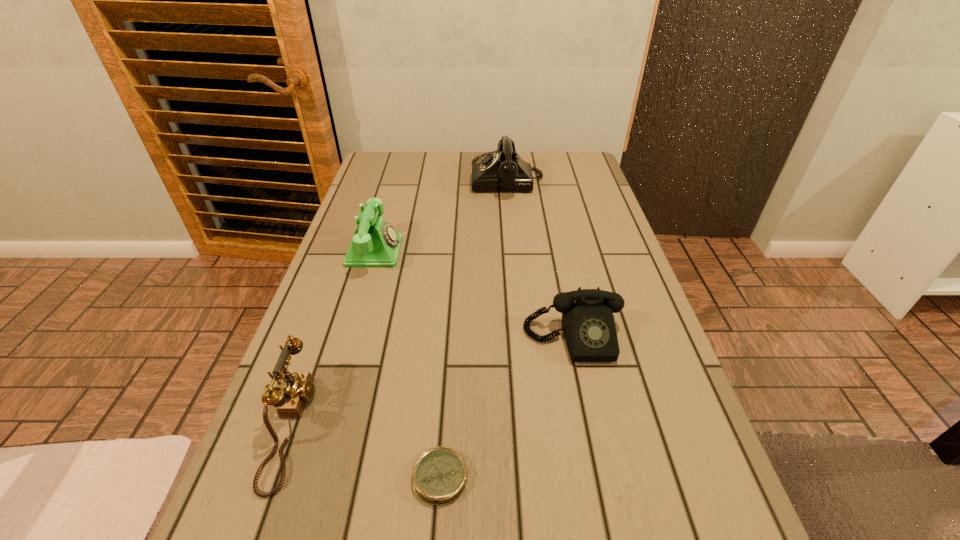
The width and height of the screenshot is (960, 540). In order to click on the farthest object in this screenshot , I will do `click(502, 170)`.

This screenshot has width=960, height=540. I want to click on the fourth nearest object, so click(x=375, y=243).

You are a GUI agent. You are given a task and a screenshot of the screen. Output one action in this format:
    pyautogui.click(x=<x>, y=<y>)
    Task: Click on the nearest telephone
    The height and width of the screenshot is (540, 960).
    Given the screenshot: What is the action you would take?
    pyautogui.click(x=298, y=388)

Locate an element on the screen. This screenshot has width=960, height=540. the shortest telephone is located at coordinates (588, 324).

The width and height of the screenshot is (960, 540). In order to click on the second shortest object in this screenshot , I will do `click(588, 324)`.

The width and height of the screenshot is (960, 540). Identify the location of the shortest object. pos(440,475).

Locate an element on the screen. free spot located 0.280m on the dial of the farthest telephone is located at coordinates (386, 179).

The width and height of the screenshot is (960, 540). Identify the location of free space located 0.220m on the dial of the farthest telephone. (404, 179).

Locate an element on the screen. free region located on the dial of the farthest telephone is located at coordinates (456, 179).

Where is `free spot located 0.240m on the dial of the second farthest object`? free spot located 0.240m on the dial of the second farthest object is located at coordinates (492, 251).